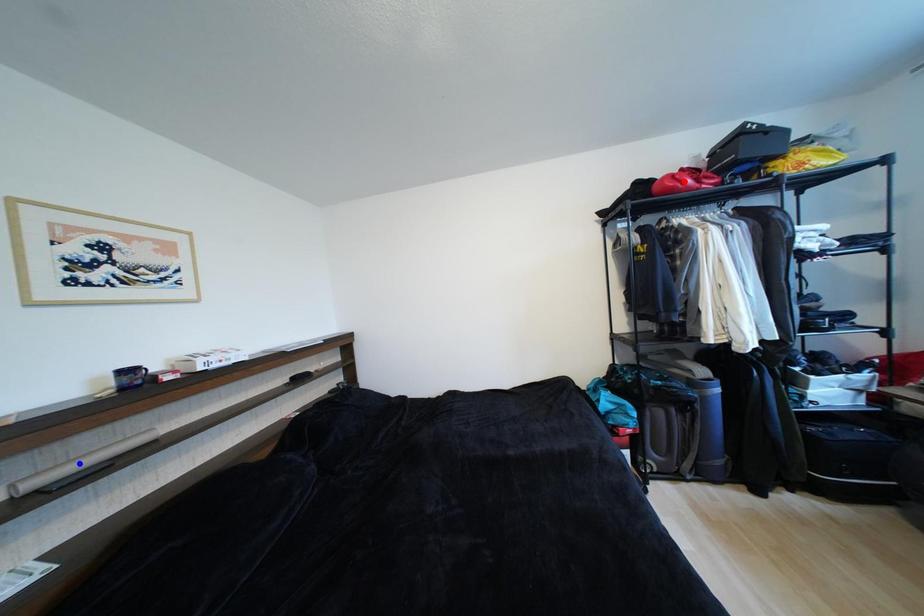
Question: Two points are marked on the image. Which point is closer to the camera?

Choices:
 (A) Blue point is closer.
 (B) Red point is closer.

Answer: (A)